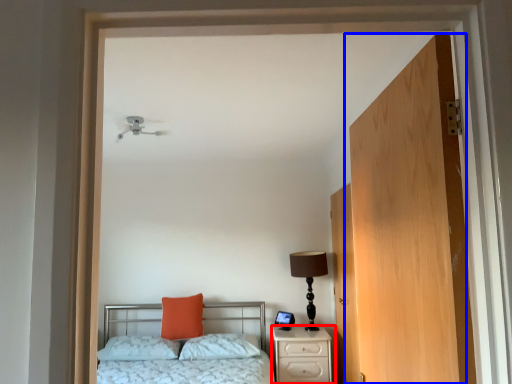
Question: Which object appears farthest to the camera in this image, nightstand (highlighted by a red box) or door (highlighted by a blue box)?

Choices:
 (A) nightstand
 (B) door

Answer: (A)